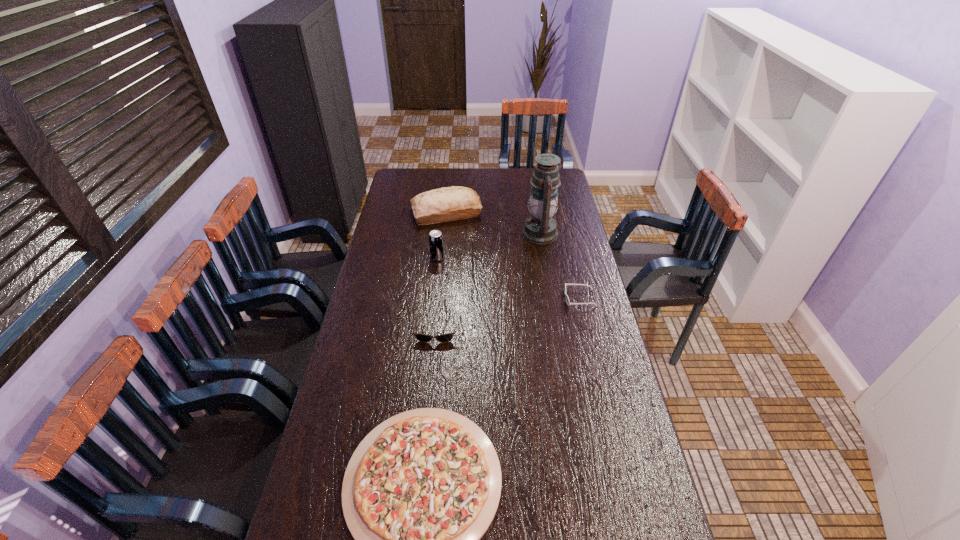
You are a GUI agent. You are given a task and a screenshot of the screen. Output one action in this format:
    pyautogui.click(x=<x>, y=<y>)
    Task: Click on the vacant space situated 0.300m on the lenses of the second nearest object
    This screenshot has width=960, height=540.
    Given the screenshot: What is the action you would take?
    pyautogui.click(x=426, y=423)

The image size is (960, 540). In order to click on vacant space situated 0.350m with the lenses of the third nearest object facing outward in this screenshot , I will do `click(472, 298)`.

Find the location of a particular element. vacant space located with the lenses of the third nearest object facing outward is located at coordinates (470, 298).

This screenshot has width=960, height=540. I want to click on vacant space located with the lenses of the third nearest object facing outward, so click(x=475, y=298).

In order to click on object that is at the left edge in this screenshot , I will do `click(445, 204)`.

You are a GUI agent. You are given a task and a screenshot of the screen. Output one action in this format:
    pyautogui.click(x=<x>, y=<y>)
    Task: Click on the oil lamp present at the right edge
    The image size is (960, 540).
    Given the screenshot: What is the action you would take?
    (x=540, y=228)

Find the location of a particular element. This screenshot has width=960, height=540. sunglasses present at the right edge is located at coordinates (567, 299).

This screenshot has height=540, width=960. I want to click on vacant space at the far edge, so click(x=496, y=188).

This screenshot has width=960, height=540. In the image, there is a desktop. Find the location of `blank space at the left edge`. blank space at the left edge is located at coordinates click(375, 335).

Find the location of a particular element. The height and width of the screenshot is (540, 960). vacant space at the right edge of the desktop is located at coordinates (563, 250).